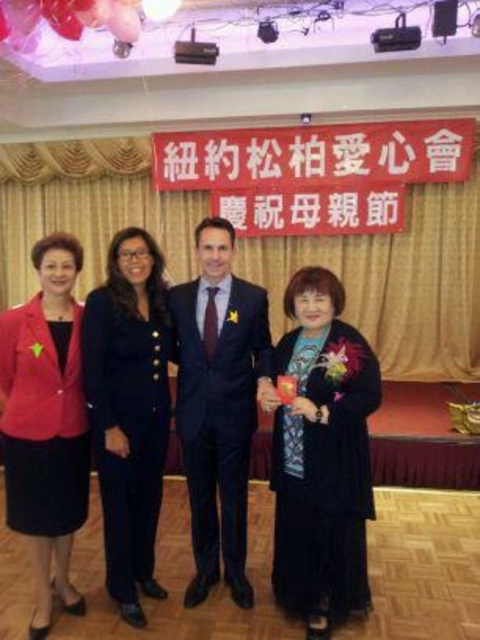
Question: In this image, where is velvet black dress at center located relative to matte red blazer at left?

Choices:
 (A) below
 (B) above

Answer: (A)

Question: Which object is farther from the camera taking this photo?

Choices:
 (A) velvet black dress at center
 (B) satin suit at center
 (C) matte red blazer at left

Answer: (B)

Question: Estimate the real-world distances between objects in this image. Which object is closer to the matte red blazer at left?

Choices:
 (A) satin suit at center
 (B) dark blue suit at center
 (C) velvet black dress at center

Answer: (B)

Question: Does satin suit at center appear on the right side of matte red blazer at left?

Choices:
 (A) yes
 (B) no

Answer: (A)

Question: From the image, what is the correct spatial relationship of dark blue suit at center in relation to satin suit at center?

Choices:
 (A) right
 (B) left

Answer: (B)

Question: Estimate the real-world distances between objects in this image. Which object is closer to the matte red blazer at left?

Choices:
 (A) dark blue suit at center
 (B) satin suit at center
 (C) velvet black dress at center

Answer: (A)